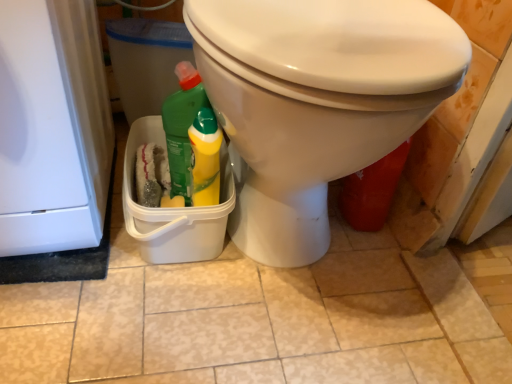
Image resolution: width=512 pixels, height=384 pixels. What do you see at coordinates (317, 101) in the screenshot? I see `white glossy toilet at center` at bounding box center [317, 101].

Locate an element on the screen. The width and height of the screenshot is (512, 384). white glossy toilet at center is located at coordinates (317, 101).

Locate an element on the screen. This screenshot has width=512, height=384. white glossy toilet at center is located at coordinates (317, 101).